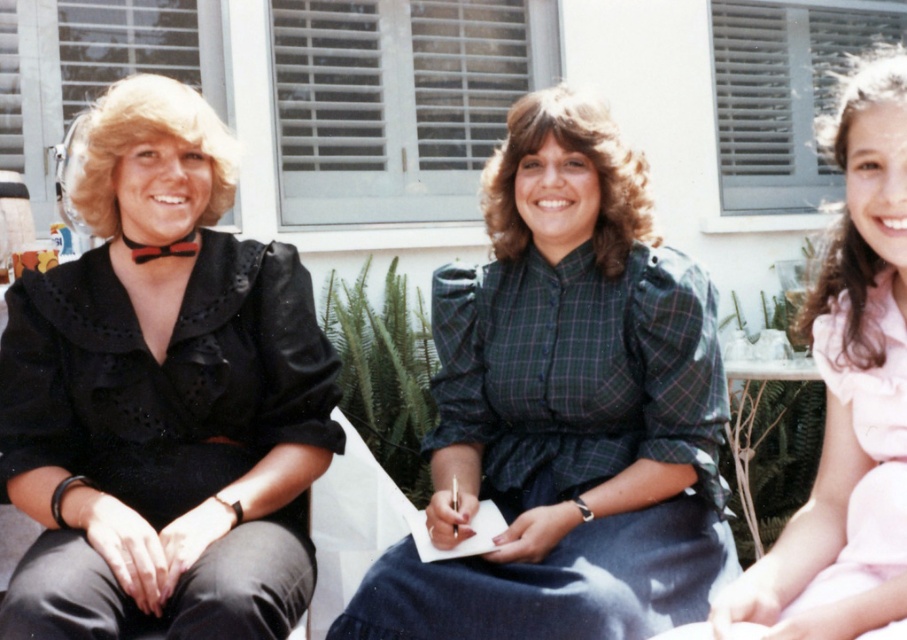
You are a photographer taking a group photo of the black satin blouse at left and the green plaid dress at center. Which clothing item should you focus on first if you want to capture both in the frame without moving the camera?

The black satin blouse at left is positioned on the left side of the green plaid dress at center, so you should focus on the black satin blouse at left first to ensure both are in frame without moving the camera.

Based on the scene described, which object is larger in size between the black satin blouse at left and the pink satin dress at right?

The black satin blouse at left is larger in size than the pink satin dress at right.

You are a photographer setting up a shoot and need to position a prop between the green plaid dress at center and the pink satin dress at right. Based on their arrangement, where should you place the prop to ensure it is between them?

The prop should be placed between the green plaid dress at center and the pink satin dress at right, as the green plaid dress at center is to the left of the pink satin dress at right.